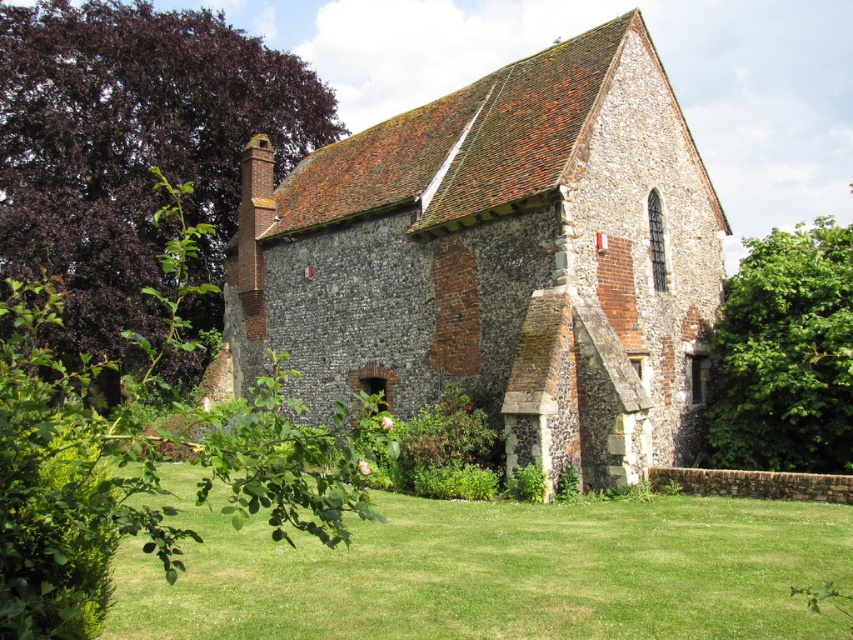
Question: Which of the following is the closest to the observer?

Choices:
 (A) brown stone church at center
 (B) purple-leaved tree at upper left

Answer: (A)

Question: Does purple-leaved tree at upper left come in front of green leafy tree at right?

Choices:
 (A) yes
 (B) no

Answer: (B)

Question: Is the position of brown stone church at center less distant than that of purple-leaved tree at upper left?

Choices:
 (A) no
 (B) yes

Answer: (B)

Question: Among these objects, which one is farthest from the camera?

Choices:
 (A) purple-leaved tree at upper left
 (B) green leafy tree at right
 (C) brown stone church at center

Answer: (A)

Question: Considering the relative positions of green grass at lower center and green leafy tree at right in the image provided, where is green grass at lower center located with respect to green leafy tree at right?

Choices:
 (A) left
 (B) right

Answer: (A)

Question: Which object is closer to the camera taking this photo?

Choices:
 (A) brown stone church at center
 (B) green grass at lower center
 (C) green leafy tree at right
 (D) purple-leaved tree at upper left

Answer: (B)